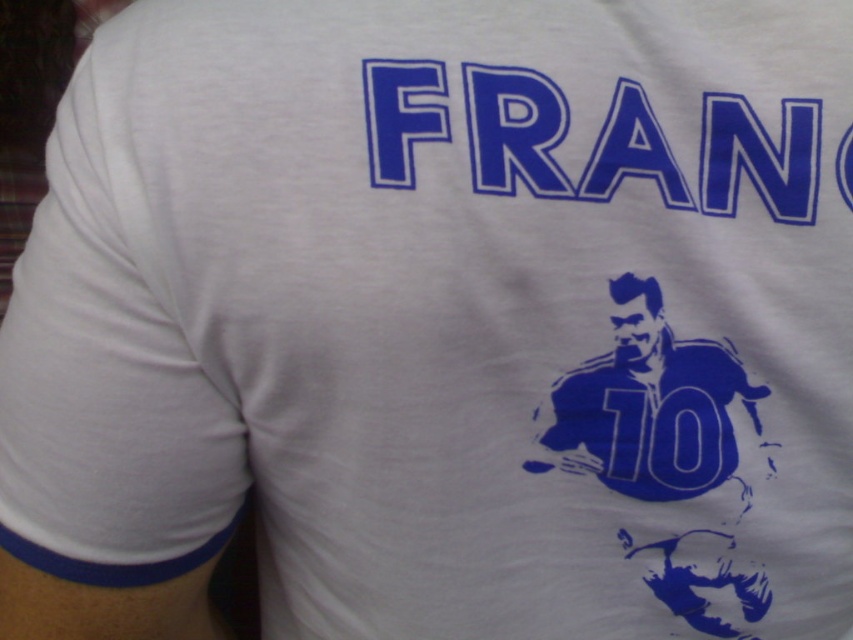
You are a photographer taking a picture of the blue fabric text at upper center on the back of a white T shirt. The text is part of a design that includes a soccer player graphic below it. You want to ensure the text is in focus while the soccer player graphic is slightly blurred. Based on the description, what distance should the camera focus on to achieve this effect?

The camera should focus on the blue fabric text at upper center, which is 17.05 inches from the camera, to ensure it is in focus while the soccer player graphic below it becomes slightly blurred.